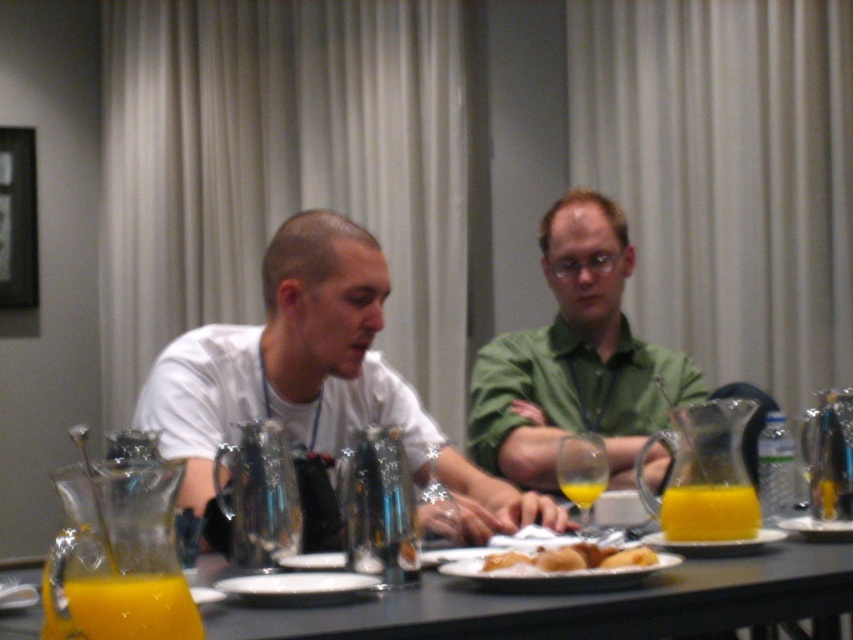
What are the coordinates of the white matte shirt at center?

The coordinates of the white matte shirt at center are at point (314, 378).

You are a server at the event and need to place a new dish on the table. The dish must be placed to the right of the white matte shirt at center. Is there space available on the table for this placement near the matte white plate at center?

The white matte shirt at center is to the left of the matte white plate at center, so placing the dish to the right of the white matte shirt at center would be near the matte white plate at center. There should be space available as the plate is positioned to the right of the shirt.